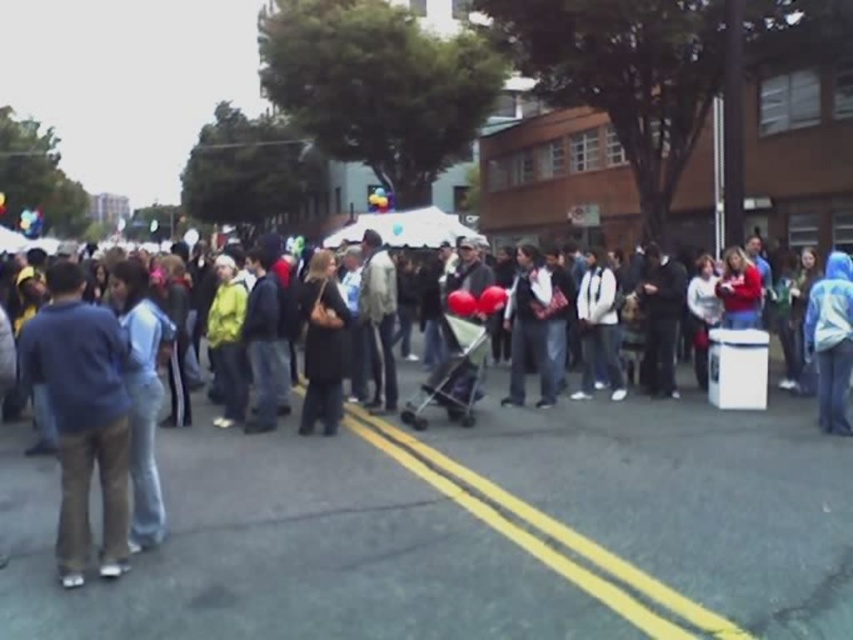
Which is above, blue cotton shirt at left or dark gray coat at center?

Positioned higher is dark gray coat at center.

Is the position of blue cotton shirt at left more distant than that of dark gray coat at center?

No, it is not.

Does point (55, 310) come behind point (305, 394)?

That is False.

Locate an element on the screen. The height and width of the screenshot is (640, 853). blue cotton shirt at left is located at coordinates (82, 417).

Between point (433, 483) and point (30, 339), which one is positioned in front?

Point (30, 339) is in front.

Is dark blue jacket at center positioned behind blue cotton shirt at left?

No, it is in front of blue cotton shirt at left.

The width and height of the screenshot is (853, 640). What do you see at coordinates (469, 524) in the screenshot?
I see `dark blue jacket at center` at bounding box center [469, 524].

I want to click on dark blue jacket at center, so click(x=469, y=524).

Does dark blue jacket at center have a greater width compared to dark gray coat at center?

Yes, dark blue jacket at center is wider than dark gray coat at center.

Locate an element on the screen. This screenshot has height=640, width=853. dark blue jacket at center is located at coordinates (469, 524).

Is point (397, 492) positioned before point (303, 298)?

Yes, it is.

Identify the location of dark blue jacket at center. This screenshot has height=640, width=853. (469, 524).